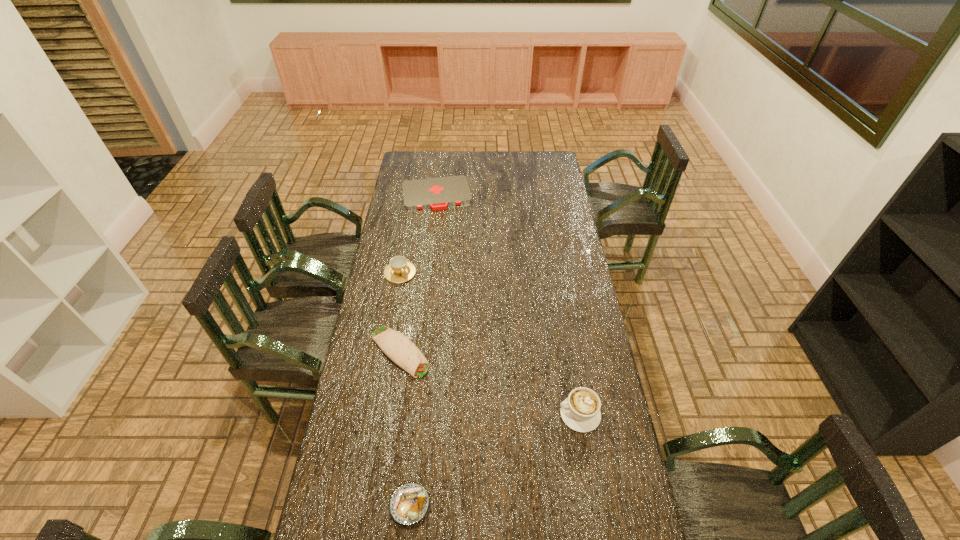
Identify the location of free space located 0.090m to the right of the cappuccino's handle. The image size is (960, 540). (x=532, y=414).

Where is `vacant space located 0.160m to the right of the cappuccino's handle`? The height and width of the screenshot is (540, 960). vacant space located 0.160m to the right of the cappuccino's handle is located at coordinates (511, 414).

This screenshot has height=540, width=960. In order to click on free space located on handle side the first-aid kit in this screenshot , I will do `click(448, 248)`.

The image size is (960, 540). Identify the location of free space located on handle side the first-aid kit. (448, 249).

In order to click on free region located on handle side the first-aid kit in this screenshot , I will do `click(446, 235)`.

This screenshot has width=960, height=540. I want to click on free space located 0.290m at the bitten end of the burrito, so click(x=477, y=423).

Find the location of a particular element. vacant area located at the bitten end of the burrito is located at coordinates (484, 429).

Locate an element on the screen. blank space located at the bitten end of the burrito is located at coordinates (486, 431).

Locate an element on the screen. The width and height of the screenshot is (960, 540). free point located 0.400m with the handle on the side of the fourth nearest object is located at coordinates (444, 350).

Identify the location of free space located 0.090m with the handle on the side of the fourth nearest object. The height and width of the screenshot is (540, 960). (414, 296).